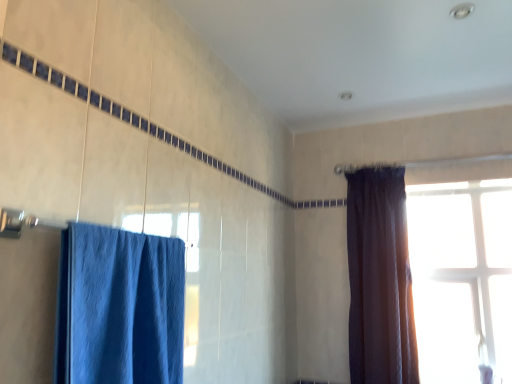
Question: From the image's perspective, is dark velvet curtain at right, the second curtain in the front-to-back sequence, under blue fabric curtain at left, the 1th curtain from the front?

Choices:
 (A) yes
 (B) no

Answer: (A)

Question: Is dark velvet curtain at right, the first curtain when ordered from right to left, shorter than blue fabric curtain at left, which ranks as the 2th curtain in back-to-front order?

Choices:
 (A) yes
 (B) no

Answer: (B)

Question: Can you confirm if dark velvet curtain at right, the second curtain in the front-to-back sequence, is smaller than blue fabric curtain at left, the first curtain viewed from the left?

Choices:
 (A) yes
 (B) no

Answer: (B)

Question: Considering the relative positions of dark velvet curtain at right, the second curtain in the front-to-back sequence, and blue fabric curtain at left, which appears as the second curtain when viewed from the right, in the image provided, is dark velvet curtain at right, the second curtain in the front-to-back sequence, in front of blue fabric curtain at left, which appears as the second curtain when viewed from the right,?

Choices:
 (A) yes
 (B) no

Answer: (B)

Question: From a real-world perspective, is dark velvet curtain at right, which ranks as the 1th curtain in back-to-front order, located higher than blue fabric curtain at left, the first curtain viewed from the left?

Choices:
 (A) yes
 (B) no

Answer: (A)

Question: From the image's perspective, is blue fabric curtain at left, which ranks as the 2th curtain in back-to-front order, located above or below dark velvet curtain at right, the first curtain when ordered from right to left?

Choices:
 (A) below
 (B) above

Answer: (B)

Question: Is point (97, 225) closer or farther from the camera than point (351, 369)?

Choices:
 (A) farther
 (B) closer

Answer: (B)

Question: From a real-world perspective, is blue fabric curtain at left, the first curtain viewed from the left, above or below dark velvet curtain at right, the second curtain in the front-to-back sequence?

Choices:
 (A) above
 (B) below

Answer: (B)

Question: Is blue fabric curtain at left, the 1th curtain from the front, inside the boundaries of dark velvet curtain at right, the first curtain when ordered from right to left, or outside?

Choices:
 (A) outside
 (B) inside

Answer: (A)

Question: From the image's perspective, is dark velvet curtain at right, the second curtain in the front-to-back sequence, positioned above or below blue fabric curtain at left, the 1th curtain from the front?

Choices:
 (A) below
 (B) above

Answer: (A)

Question: Is point (393, 178) positioned closer to the camera than point (70, 349)?

Choices:
 (A) closer
 (B) farther

Answer: (B)

Question: In terms of size, does dark velvet curtain at right, the second curtain in the front-to-back sequence, appear bigger or smaller than blue fabric curtain at left, which ranks as the 2th curtain in back-to-front order?

Choices:
 (A) big
 (B) small

Answer: (A)

Question: Looking at their shapes, would you say dark velvet curtain at right, the second curtain in the front-to-back sequence, is wider or thinner than blue fabric curtain at left, which appears as the second curtain when viewed from the right?

Choices:
 (A) wide
 (B) thin

Answer: (B)

Question: Is point coord(414,251) closer or farther from the camera than point coord(385,311)?

Choices:
 (A) farther
 (B) closer

Answer: (A)

Question: From a real-world perspective, is transparent glass window at upper right above or below dark velvet curtain at right, the first curtain when ordered from right to left?

Choices:
 (A) below
 (B) above

Answer: (A)